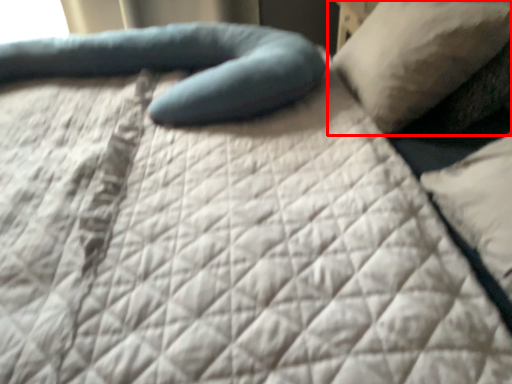
Question: From the image's perspective, considering the relative positions of pillow (annotated by the red box) and pillow in the image provided, where is pillow (annotated by the red box) located with respect to the staircase?

Choices:
 (A) above
 (B) below

Answer: (A)